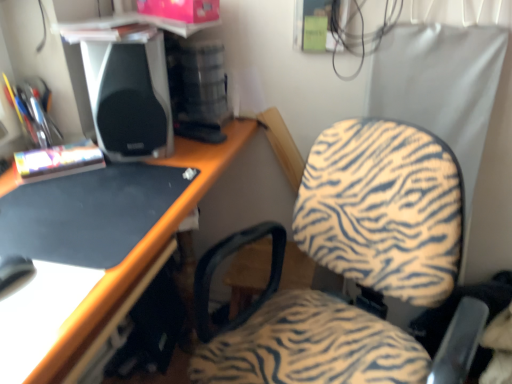
Image resolution: width=512 pixels, height=384 pixels. What are the coordinates of `satin black speaker at upper left` in the screenshot? It's located at (128, 90).

What do you see at coordinates (128, 90) in the screenshot?
I see `satin black speaker at upper left` at bounding box center [128, 90].

Consider the image. Measure the distance between point (92, 64) and camera.

1.01 meters.

Locate an element on the screen. Image resolution: width=512 pixels, height=384 pixels. zebra-patterned fabric chair at center is located at coordinates (384, 208).

What do you see at coordinates (384, 208) in the screenshot? The width and height of the screenshot is (512, 384). I see `zebra-patterned fabric chair at center` at bounding box center [384, 208].

Locate an element on the screen. satin black speaker at upper left is located at coordinates (128, 90).

Is satin black speaker at upper left to the left or to the right of zebra-patterned fabric chair at center in the image?

From the image, it's evident that satin black speaker at upper left is to the left of zebra-patterned fabric chair at center.

From the picture: Is satin black speaker at upper left positioned before zebra-patterned fabric chair at center?

No, it is behind zebra-patterned fabric chair at center.

Which is behind, point (117, 105) or point (334, 325)?

The point (334, 325) is farther from the camera.

From the image's perspective, is satin black speaker at upper left on zebra-patterned fabric chair at center?

Indeed, from the image's perspective, satin black speaker at upper left is shown above zebra-patterned fabric chair at center.

From a real-world perspective, is satin black speaker at upper left below zebra-patterned fabric chair at center?

No, from a real-world perspective, satin black speaker at upper left is not below zebra-patterned fabric chair at center.

Which of these two, satin black speaker at upper left or zebra-patterned fabric chair at center, is wider?

zebra-patterned fabric chair at center.

Which of these two, satin black speaker at upper left or zebra-patterned fabric chair at center, stands taller?

zebra-patterned fabric chair at center.

Does satin black speaker at upper left have a smaller size compared to zebra-patterned fabric chair at center?

Correct, satin black speaker at upper left occupies less space than zebra-patterned fabric chair at center.

Is satin black speaker at upper left spatially inside zebra-patterned fabric chair at center, or outside of it?

satin black speaker at upper left is outside zebra-patterned fabric chair at center.

Is satin black speaker at upper left not near zebra-patterned fabric chair at center?

satin black speaker at upper left is actually quite close to zebra-patterned fabric chair at center.

In the scene shown: Could you tell me if satin black speaker at upper left is facing zebra-patterned fabric chair at center?

Yes.

How much distance is there between satin black speaker at upper left and zebra-patterned fabric chair at center?

satin black speaker at upper left and zebra-patterned fabric chair at center are 21.22 inches apart.

The width and height of the screenshot is (512, 384). What are the coordinates of `speaker that appears above the zebra-patterned fabric chair at center (from the image's perspective)` in the screenshot? It's located at pyautogui.click(x=128, y=90).

Which is more to the left, zebra-patterned fabric chair at center or satin black speaker at upper left?

From the viewer's perspective, satin black speaker at upper left appears more on the left side.

In the image, is zebra-patterned fabric chair at center positioned in front of or behind satin black speaker at upper left?

In the image, zebra-patterned fabric chair at center appears in front of satin black speaker at upper left.

Is point (238, 374) positioned behind point (144, 59)?

That is False.

In the scene shown: From the image's perspective, is zebra-patterned fabric chair at center on top of satin black speaker at upper left?

Actually, zebra-patterned fabric chair at center appears below satin black speaker at upper left in the image.

From a real-world perspective, is zebra-patterned fabric chair at center above or below satin black speaker at upper left?

zebra-patterned fabric chair at center is below satin black speaker at upper left.

Between zebra-patterned fabric chair at center and satin black speaker at upper left, which one has smaller width?

Thinner between the two is satin black speaker at upper left.

Considering the sizes of zebra-patterned fabric chair at center and satin black speaker at upper left in the image, is zebra-patterned fabric chair at center taller or shorter than satin black speaker at upper left?

In the image, zebra-patterned fabric chair at center appears to be taller than satin black speaker at upper left.

Between zebra-patterned fabric chair at center and satin black speaker at upper left, which one has smaller size?

satin black speaker at upper left is smaller.

Is satin black speaker at upper left located within zebra-patterned fabric chair at center?

Definitely not — satin black speaker at upper left is not inside zebra-patterned fabric chair at center.

Is zebra-patterned fabric chair at center far away from satin black speaker at upper left?

No, there isn't a large distance between zebra-patterned fabric chair at center and satin black speaker at upper left.

Is zebra-patterned fabric chair at center looking in the opposite direction of satin black speaker at upper left?

No, satin black speaker at upper left is not at the back of zebra-patterned fabric chair at center.

Can you tell me how much zebra-patterned fabric chair at center and satin black speaker at upper left differ in facing direction?

The facing directions of zebra-patterned fabric chair at center and satin black speaker at upper left are 54.9 degrees apart.

Find the location of `speaker above the zebra-patterned fabric chair at center (from the image's perspective)`. speaker above the zebra-patterned fabric chair at center (from the image's perspective) is located at coordinates (128, 90).

The height and width of the screenshot is (384, 512). Identify the location of chair below the satin black speaker at upper left (from a real-world perspective). click(384, 208).

The width and height of the screenshot is (512, 384). Identify the location of chair lying below the satin black speaker at upper left (from the image's perspective). (384, 208).